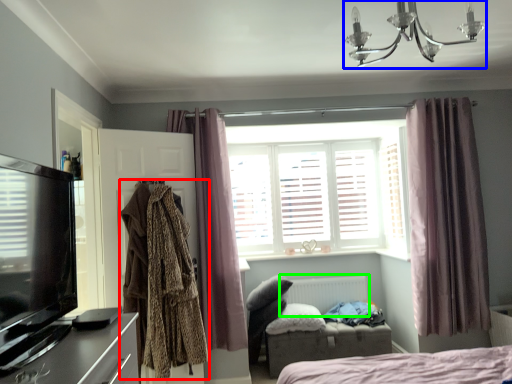
Question: Considering the real-world distances, which object is farthest from clothing (highlighted by a red box)? light fixture (highlighted by a blue box) or radiator (highlighted by a green box)?

Choices:
 (A) light fixture
 (B) radiator

Answer: (A)